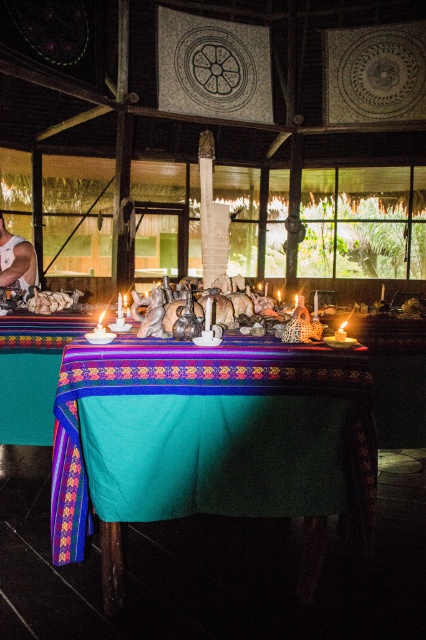
Question: Which object is closer to the camera taking this photo?

Choices:
 (A) muscular skin torso at lower left
 (B) teal fabric table at center

Answer: (B)

Question: Which object appears farthest from the camera in this image?

Choices:
 (A) muscular skin torso at lower left
 (B) teal fabric table at center

Answer: (A)

Question: Observing the image, what is the correct spatial positioning of teal fabric table at center in reference to muscular skin torso at lower left?

Choices:
 (A) below
 (B) above

Answer: (A)

Question: Is teal fabric table at center thinner than muscular skin torso at lower left?

Choices:
 (A) yes
 (B) no

Answer: (B)

Question: Is teal fabric table at center above muscular skin torso at lower left?

Choices:
 (A) no
 (B) yes

Answer: (A)